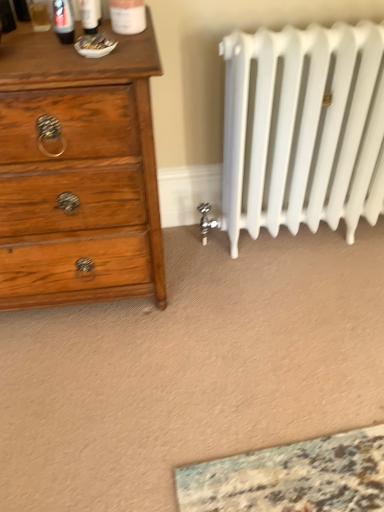
The width and height of the screenshot is (384, 512). What do you see at coordinates (79, 172) in the screenshot? I see `wooden chest of drawers at left` at bounding box center [79, 172].

Measure the distance between wooden chest of drawers at left and camera.

The distance of wooden chest of drawers at left from camera is 34.24 inches.

At what (x,y) coordinates should I click in order to perform the action: click on wooden chest of drawers at left. Please return your answer as a coordinate pair (x, y). This screenshot has height=512, width=384. Looking at the image, I should click on (79, 172).

Locate an element on the screen. This screenshot has height=512, width=384. wooden chest of drawers at left is located at coordinates (79, 172).